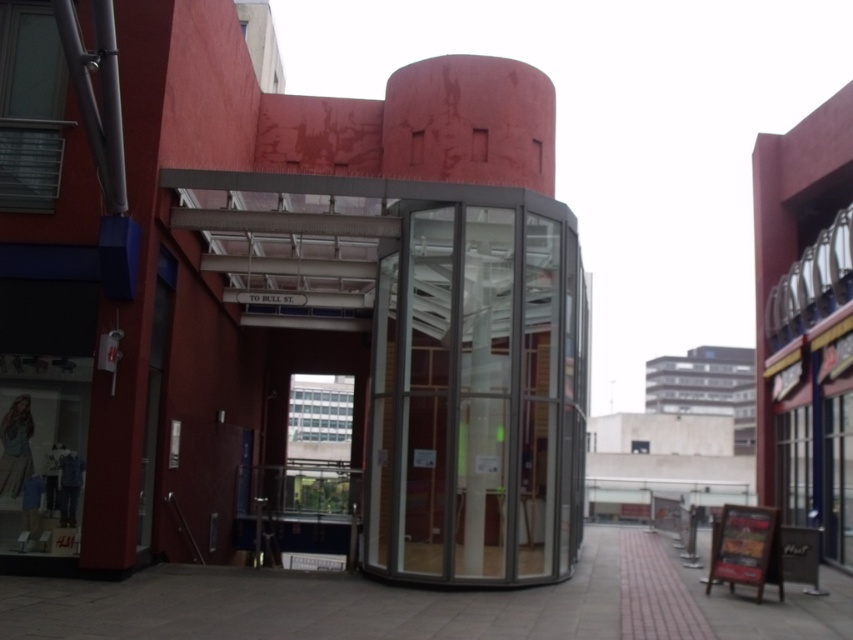
You are standing at the entrance of the building and want to take the transparent glass elevator at center to the top floor. However, you notice the paved stone pavement at center is in your way. Can you still reach the elevator without moving the pavement?

The transparent glass elevator at center is taller than the paved stone pavement at center, so yes, you can still reach the elevator by stepping onto the paved stone pavement at center and accessing the elevator which is elevated above it.

You are an architect visiting the building and want to compare the sizes of the transparent glass elevator at center and the paved stone pavement at center. Which one is smaller?

The transparent glass elevator at center is smaller than the paved stone pavement at center.

You are standing at the entrance of the building and want to take the transparent glass elevator at center to the top floor. Since the elevator is above the paved stone pavement at center, where should you look to find the elevator?

The transparent glass elevator at center is above the paved stone pavement at center, so you should look upwards from the paved stone pavement at center to find the elevator.